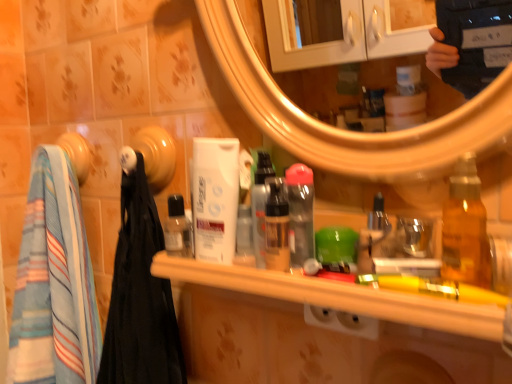
This screenshot has width=512, height=384. Describe the element at coordinates (276, 227) in the screenshot. I see `matte plastic mouthwash at center, which is counted as the 3th mouthwash, starting from the left` at that location.

Based on the photo, what is the approximate width of translucent plastic spray bottle at center, marked as the 1th bottle in a back-to-front arrangement?

translucent plastic spray bottle at center, marked as the 1th bottle in a back-to-front arrangement, is 2.03 inches wide.

I want to click on white matte mouthwash at center, the 2th mouthwash in the left-to-right sequence, so click(x=215, y=198).

Locate an element on the screen. Image resolution: width=512 pixels, height=384 pixels. white glossy towel bar at upper left is located at coordinates point(77,153).

From the image's perspective, relative to transparent plastic bottle at center, which is the fourth mouthwash in right-to-left order, is transparent plastic bottle at center, the 1th mouthwash when ordered from right to left, above or below?

From the image's perspective, transparent plastic bottle at center, the 1th mouthwash when ordered from right to left, appears above transparent plastic bottle at center, which is the fourth mouthwash in right-to-left order.

Is transparent plastic bottle at center, arranged as the fourth mouthwash when viewed from the left, positioned in front of transparent plastic bottle at center, which is the first mouthwash in left-to-right order?

Yes, transparent plastic bottle at center, arranged as the fourth mouthwash when viewed from the left, is in front of transparent plastic bottle at center, which is the first mouthwash in left-to-right order.

From the picture: Can you confirm if transparent plastic bottle at center, arranged as the fourth mouthwash when viewed from the left, is wider than transparent plastic bottle at center, which is the fourth mouthwash in right-to-left order?

In fact, transparent plastic bottle at center, arranged as the fourth mouthwash when viewed from the left, might be narrower than transparent plastic bottle at center, which is the fourth mouthwash in right-to-left order.

Starting from the transparent plastic bottle at center, which is the fourth mouthwash in right-to-left order, which mouthwash is the 3rd one to the right? Please provide its 2D coordinates.

[(300, 213)]

Is white glossy towel bar at upper left oriented towards translucent amber bottle at right, the 1th bottle positioned from the right?

No, white glossy towel bar at upper left does not turn towards translucent amber bottle at right, the 1th bottle positioned from the right.

Can you confirm if white glossy towel bar at upper left is shorter than translucent amber bottle at right, positioned as the second bottle in left-to-right order?

Yes.

From the image's perspective, is white glossy towel bar at upper left on top of translucent amber bottle at right, the 1th bottle positioned from the right?

Yes, from the image's perspective, white glossy towel bar at upper left is over translucent amber bottle at right, the 1th bottle positioned from the right.

Is white glossy towel bar at upper left touching translucent amber bottle at right, acting as the 1th bottle starting from the front?

No.

Consider the image. From the image's perspective, would you say white matte mouthwash at center, which is the third mouthwash in right-to-left order, is shown under striped cotton towel at left?

No, from the image's perspective, white matte mouthwash at center, which is the third mouthwash in right-to-left order, is not below striped cotton towel at left.

Is white matte mouthwash at center, which is the third mouthwash in right-to-left order, positioned before striped cotton towel at left?

Yes, the depth of white matte mouthwash at center, which is the third mouthwash in right-to-left order, is less than that of striped cotton towel at left.

Between white matte mouthwash at center, which is the third mouthwash in right-to-left order, and striped cotton towel at left, which one has less height?

Standing shorter between the two is white matte mouthwash at center, which is the third mouthwash in right-to-left order.

Would you consider white matte mouthwash at center, the 2th mouthwash in the left-to-right sequence, to be distant from striped cotton towel at left?

No, white matte mouthwash at center, the 2th mouthwash in the left-to-right sequence, is in close proximity to striped cotton towel at left.

Is striped cotton towel at left placed right next to white matte mouthwash at center, which is the third mouthwash in right-to-left order?

No.

Which is more to the right, striped cotton towel at left or white matte mouthwash at center, which is the third mouthwash in right-to-left order?

From the viewer's perspective, white matte mouthwash at center, which is the third mouthwash in right-to-left order, appears more on the right side.

From the image's perspective, is striped cotton towel at left beneath white matte mouthwash at center, which is the third mouthwash in right-to-left order?

Indeed, from the image's perspective, striped cotton towel at left is shown beneath white matte mouthwash at center, which is the third mouthwash in right-to-left order.

The width and height of the screenshot is (512, 384). Find the location of `bath towel behind the white matte mouthwash at center, the 2th mouthwash in the left-to-right sequence`. bath towel behind the white matte mouthwash at center, the 2th mouthwash in the left-to-right sequence is located at coordinates (54, 282).

Which is behind, translucent plastic spray bottle at center, the 1th bottle positioned from the left, or white matte mouthwash at center, the 2th mouthwash in the left-to-right sequence?

Positioned behind is white matte mouthwash at center, the 2th mouthwash in the left-to-right sequence.

Is translucent plastic spray bottle at center, acting as the second bottle starting from the right, not inside white matte mouthwash at center, the 2th mouthwash in the left-to-right sequence?

Yes, translucent plastic spray bottle at center, acting as the second bottle starting from the right, is located beyond the bounds of white matte mouthwash at center, the 2th mouthwash in the left-to-right sequence.

From the image's perspective, relative to white matte mouthwash at center, which is the third mouthwash in right-to-left order, is translucent plastic spray bottle at center, the 1th bottle positioned from the left, above or below?

From the image's perspective, translucent plastic spray bottle at center, the 1th bottle positioned from the left, appears below white matte mouthwash at center, which is the third mouthwash in right-to-left order.

Considering the points (259, 252) and (223, 161), which point is in front, point (259, 252) or point (223, 161)?

Positioned in front is point (259, 252).

Looking at this image, is translucent plastic spray bottle at center, which is the second bottle from front to back, outside of transparent plastic bottle at center, which is the first mouthwash in left-to-right order?

That's correct, translucent plastic spray bottle at center, which is the second bottle from front to back, is outside of transparent plastic bottle at center, which is the first mouthwash in left-to-right order.

The height and width of the screenshot is (384, 512). Find the location of `bottle that is the 2nd object above the transparent plastic bottle at center, which is the fourth mouthwash in right-to-left order (from a real-world perspective)`. bottle that is the 2nd object above the transparent plastic bottle at center, which is the fourth mouthwash in right-to-left order (from a real-world perspective) is located at coordinates (260, 205).

Does translucent plastic spray bottle at center, marked as the 1th bottle in a back-to-front arrangement, have a smaller size compared to transparent plastic bottle at center, which is the fourth mouthwash in right-to-left order?

Indeed, translucent plastic spray bottle at center, marked as the 1th bottle in a back-to-front arrangement, has a smaller size compared to transparent plastic bottle at center, which is the fourth mouthwash in right-to-left order.

In terms of width, does translucent plastic spray bottle at center, the 1th bottle positioned from the left, look wider or thinner when compared to transparent plastic bottle at center, which is the first mouthwash in left-to-right order?

In the image, translucent plastic spray bottle at center, the 1th bottle positioned from the left, appears to be more narrow than transparent plastic bottle at center, which is the first mouthwash in left-to-right order.

Between white matte mouthwash at center, which is the third mouthwash in right-to-left order, and transparent plastic bottle at center, which is the first mouthwash in left-to-right order, which one has smaller width?

With smaller width is transparent plastic bottle at center, which is the first mouthwash in left-to-right order.

Is there a large distance between white matte mouthwash at center, which is the third mouthwash in right-to-left order, and transparent plastic bottle at center, which is the first mouthwash in left-to-right order?

No, white matte mouthwash at center, which is the third mouthwash in right-to-left order, is not far from transparent plastic bottle at center, which is the first mouthwash in left-to-right order.

Consider the image. Is white matte mouthwash at center, which is the third mouthwash in right-to-left order, oriented away from transparent plastic bottle at center, which is the fourth mouthwash in right-to-left order?

No, white matte mouthwash at center, which is the third mouthwash in right-to-left order, is not facing away from transparent plastic bottle at center, which is the fourth mouthwash in right-to-left order.

Where is `mouthwash that is the 3rd object directly below the white matte mouthwash at center, the 2th mouthwash in the left-to-right sequence (from a real-world perspective)`? This screenshot has height=384, width=512. mouthwash that is the 3rd object directly below the white matte mouthwash at center, the 2th mouthwash in the left-to-right sequence (from a real-world perspective) is located at coordinates coord(178,229).

This screenshot has height=384, width=512. I want to click on the 2nd mouthwash behind the transparent plastic bottle at center, arranged as the fourth mouthwash when viewed from the left, so click(x=178, y=229).

At what (x,y) coordinates should I click in order to perform the action: click on towel bar on the left of translucent amber bottle at right, positioned as the second bottle in left-to-right order. Please return your answer as a coordinate pair (x, y). Image resolution: width=512 pixels, height=384 pixels. Looking at the image, I should click on (77, 153).

Looking at the image, which one is located closer to transparent plastic bottle at center, arranged as the fourth mouthwash when viewed from the left, white glossy towel bar at upper left or matte plastic mouthwash at center, the 2th mouthwash when ordered from right to left?

matte plastic mouthwash at center, the 2th mouthwash when ordered from right to left.

Based on their spatial positions, is transparent plastic bottle at center, which is the first mouthwash in left-to-right order, or white glossy towel bar at upper left closer to transparent plastic bottle at center, the 1th mouthwash when ordered from right to left?

The object closer to transparent plastic bottle at center, the 1th mouthwash when ordered from right to left, is transparent plastic bottle at center, which is the first mouthwash in left-to-right order.

Which object lies further to the anchor point wooden shelf at center, white glossy towel bar at upper left or striped cotton towel at left?

white glossy towel bar at upper left is further to wooden shelf at center.

From the picture: From the image, which object appears to be nearer to transparent plastic bottle at center, which is the first mouthwash in left-to-right order, white matte mouthwash at center, the 2th mouthwash in the left-to-right sequence, or translucent plastic spray bottle at center, acting as the second bottle starting from the right?

white matte mouthwash at center, the 2th mouthwash in the left-to-right sequence, is positioned closer to the anchor transparent plastic bottle at center, which is the first mouthwash in left-to-right order.

Looking at this image, looking at the image, which one is located closer to translucent amber bottle at right, acting as the 1th bottle starting from the front, transparent plastic bottle at center, arranged as the fourth mouthwash when viewed from the left, or white matte mouthwash at center, which is the third mouthwash in right-to-left order?

transparent plastic bottle at center, arranged as the fourth mouthwash when viewed from the left, is closer to translucent amber bottle at right, acting as the 1th bottle starting from the front.

Looking at the image, which one is located closer to matte plastic mouthwash at center, the 2th mouthwash when ordered from right to left, transparent plastic bottle at center, arranged as the fourth mouthwash when viewed from the left, or white glossy towel bar at upper left?

Based on the image, transparent plastic bottle at center, arranged as the fourth mouthwash when viewed from the left, appears to be nearer to matte plastic mouthwash at center, the 2th mouthwash when ordered from right to left.

When comparing their distances from wooden shelf at center, does white glossy towel bar at upper left or transparent plastic bottle at center, which is the first mouthwash in left-to-right order, seem further?

white glossy towel bar at upper left is positioned further to the anchor wooden shelf at center.

From the image, which object appears to be farther from wooden shelf at center, striped cotton towel at left or white glossy towel bar at upper left?

white glossy towel bar at upper left is further to wooden shelf at center.

Where is `counter between transparent plastic bottle at center, which is the fourth mouthwash in right-to-left order, and translucent amber bottle at right, acting as the 1th bottle starting from the front, from left to right`? counter between transparent plastic bottle at center, which is the fourth mouthwash in right-to-left order, and translucent amber bottle at right, acting as the 1th bottle starting from the front, from left to right is located at coordinates (340, 296).

Image resolution: width=512 pixels, height=384 pixels. In order to click on towel bar between striped cotton towel at left and wooden shelf at center in the horizontal direction in this screenshot , I will do `click(77, 153)`.

The width and height of the screenshot is (512, 384). I want to click on mouthwash positioned between wooden shelf at center and transparent plastic bottle at center, the 1th mouthwash when ordered from right to left, from near to far, so click(x=276, y=227).

Identify the location of bottle located between striped cotton towel at left and matte plastic mouthwash at center, the 2th mouthwash when ordered from right to left, in the left-right direction. (260, 205).